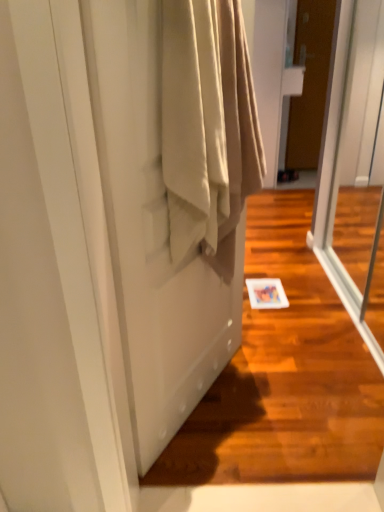
Measure the distance between satin beige curtain at lower left, the 1th screen door from the left, and camera.

The depth of satin beige curtain at lower left, the 1th screen door from the left, is 32.10 inches.

What do you see at coordinates (355, 172) in the screenshot? Image resolution: width=384 pixels, height=512 pixels. I see `transparent glass screen door at right, arranged as the 2th screen door when viewed from the left` at bounding box center [355, 172].

Describe the element at coordinates (310, 82) in the screenshot. The height and width of the screenshot is (512, 384). I see `brown matte door at upper right` at that location.

At what (x,y) coordinates should I click in order to perform the action: click on beige fabric at center. Please return your answer as a coordinate pair (x, y). This screenshot has height=512, width=384. Looking at the image, I should click on (207, 122).

From the image's perspective, relative to satin beige curtain at lower left, arranged as the 2th screen door when viewed from the right, is beige fabric at center above or below?

beige fabric at center is situated higher than satin beige curtain at lower left, arranged as the 2th screen door when viewed from the right, in the image.

Considering the sizes of beige fabric at center and satin beige curtain at lower left, the 1th screen door from the left, in the image, is beige fabric at center taller or shorter than satin beige curtain at lower left, the 1th screen door from the left,?

Considering their sizes, beige fabric at center has less height than satin beige curtain at lower left, the 1th screen door from the left.

Which object is closer to the camera taking this photo, beige fabric at center or satin beige curtain at lower left, arranged as the 2th screen door when viewed from the right?

satin beige curtain at lower left, arranged as the 2th screen door when viewed from the right, is in front.

Could you tell me if beige fabric at center is facing satin beige curtain at lower left, the 1th screen door from the left?

Yes, beige fabric at center faces towards satin beige curtain at lower left, the 1th screen door from the left.

Is brown matte door at upper right touching satin beige curtain at lower left, the 1th screen door from the left?

No, brown matte door at upper right is not beside satin beige curtain at lower left, the 1th screen door from the left.

Does brown matte door at upper right have a greater height compared to satin beige curtain at lower left, arranged as the 2th screen door when viewed from the right?

Correct, brown matte door at upper right is much taller as satin beige curtain at lower left, arranged as the 2th screen door when viewed from the right.

Based on the photo, is brown matte door at upper right oriented towards satin beige curtain at lower left, arranged as the 2th screen door when viewed from the right?

No, brown matte door at upper right is not facing towards satin beige curtain at lower left, arranged as the 2th screen door when viewed from the right.

How many degrees apart are the facing directions of brown matte door at upper right and satin beige curtain at lower left, the 1th screen door from the left?

The angle between the facing direction of brown matte door at upper right and the facing direction of satin beige curtain at lower left, the 1th screen door from the left, is 56.5 degrees.

From the image's perspective, which one is positioned lower, satin beige curtain at lower left, arranged as the 2th screen door when viewed from the right, or beige fabric at center?

satin beige curtain at lower left, arranged as the 2th screen door when viewed from the right.

Considering the positions of points (106, 53) and (234, 191), is point (106, 53) farther from camera compared to point (234, 191)?

No, (106, 53) is in front of (234, 191).

Is satin beige curtain at lower left, the 1th screen door from the left, aimed at beige fabric at center?

Yes, satin beige curtain at lower left, the 1th screen door from the left, faces towards beige fabric at center.

In the scene shown: Does satin beige curtain at lower left, arranged as the 2th screen door when viewed from the right, lie in front of beige fabric at center?

Yes, satin beige curtain at lower left, arranged as the 2th screen door when viewed from the right, is in front of beige fabric at center.

From a real-world perspective, is transparent glass screen door at right, which is counted as the first screen door, starting from the right, physically located above or below satin beige curtain at lower left, the 1th screen door from the left?

In terms of real-world spatial position, transparent glass screen door at right, which is counted as the first screen door, starting from the right, is above satin beige curtain at lower left, the 1th screen door from the left.

Does point (367, 195) lie behind point (162, 293)?

Yes, it is.

Based on the photo, does transparent glass screen door at right, which is counted as the first screen door, starting from the right, have a smaller size compared to satin beige curtain at lower left, arranged as the 2th screen door when viewed from the right?

No, transparent glass screen door at right, which is counted as the first screen door, starting from the right, is not smaller than satin beige curtain at lower left, arranged as the 2th screen door when viewed from the right.

Can you tell me how much transparent glass screen door at right, which is counted as the first screen door, starting from the right, and satin beige curtain at lower left, the 1th screen door from the left, differ in facing direction?

The facing directions of transparent glass screen door at right, which is counted as the first screen door, starting from the right, and satin beige curtain at lower left, the 1th screen door from the left, are 147 degrees apart.

From the image's perspective, is transparent glass screen door at right, arranged as the 2th screen door when viewed from the left, positioned above or below beige fabric at center?

transparent glass screen door at right, arranged as the 2th screen door when viewed from the left, is situated higher than beige fabric at center in the image.

Find the location of a particular element. The width and height of the screenshot is (384, 512). clothing located below the transparent glass screen door at right, which is counted as the first screen door, starting from the right (from the image's perspective) is located at coordinates (207, 122).

Based on their positions, is transparent glass screen door at right, arranged as the 2th screen door when viewed from the left, located to the left or right of beige fabric at center?

From the image, it's evident that transparent glass screen door at right, arranged as the 2th screen door when viewed from the left, is to the right of beige fabric at center.

Is beige fabric at center located within transparent glass screen door at right, which is counted as the first screen door, starting from the right?

Actually, beige fabric at center is outside transparent glass screen door at right, which is counted as the first screen door, starting from the right.

Is beige fabric at center completely or partially outside of brown matte door at upper right?

Indeed, beige fabric at center is completely outside brown matte door at upper right.

Are beige fabric at center and brown matte door at upper right located far from each other?

Yes, beige fabric at center and brown matte door at upper right are located far from each other.

From the image's perspective, is beige fabric at center located above or below brown matte door at upper right?

beige fabric at center is below brown matte door at upper right.

In the scene shown: From a real-world perspective, is beige fabric at center physically located above or below brown matte door at upper right?

Clearly, from a real-world perspective, beige fabric at center is above brown matte door at upper right.

Considering the points (210, 323) and (334, 173), which point is behind, point (210, 323) or point (334, 173)?

Positioned behind is point (334, 173).

Would you say satin beige curtain at lower left, the 1th screen door from the left, is inside or outside transparent glass screen door at right, which is counted as the first screen door, starting from the right?

satin beige curtain at lower left, the 1th screen door from the left, cannot be found inside transparent glass screen door at right, which is counted as the first screen door, starting from the right.

In the scene shown: In terms of width, does satin beige curtain at lower left, the 1th screen door from the left, look wider or thinner when compared to transparent glass screen door at right, arranged as the 2th screen door when viewed from the left?

Considering their sizes, satin beige curtain at lower left, the 1th screen door from the left, looks slimmer than transparent glass screen door at right, arranged as the 2th screen door when viewed from the left.

What are the coordinates of `screen door located in front of the transparent glass screen door at right, which is counted as the first screen door, starting from the right` in the screenshot? It's located at (154, 233).

At what (x,y) coordinates should I click in order to perform the action: click on screen door below the beige fabric at center (from the image's perspective). Please return your answer as a coordinate pair (x, y). The image size is (384, 512). Looking at the image, I should click on (154, 233).

From a real-world perspective, count 2nd screen doors downward from the brown matte door at upper right and point to it. Please provide its 2D coordinates.

[(154, 233)]

Looking at the image, which one is located closer to transparent glass screen door at right, which is counted as the first screen door, starting from the right, beige fabric at center or brown matte door at upper right?

Based on the image, brown matte door at upper right appears to be nearer to transparent glass screen door at right, which is counted as the first screen door, starting from the right.

From the picture: When comparing their distances from transparent glass screen door at right, which is counted as the first screen door, starting from the right, does satin beige curtain at lower left, the 1th screen door from the left, or brown matte door at upper right seem closer?

The object closer to transparent glass screen door at right, which is counted as the first screen door, starting from the right, is brown matte door at upper right.

Based on their spatial positions, is transparent glass screen door at right, which is counted as the first screen door, starting from the right, or beige fabric at center closer to brown matte door at upper right?

The object closer to brown matte door at upper right is transparent glass screen door at right, which is counted as the first screen door, starting from the right.

Considering their positions, is beige fabric at center positioned further to transparent glass screen door at right, arranged as the 2th screen door when viewed from the left, than satin beige curtain at lower left, arranged as the 2th screen door when viewed from the right?

Based on the image, beige fabric at center appears to be further to transparent glass screen door at right, arranged as the 2th screen door when viewed from the left.

When comparing their distances from brown matte door at upper right, does beige fabric at center or transparent glass screen door at right, arranged as the 2th screen door when viewed from the left, seem further?

beige fabric at center.

Which object lies further to the anchor point satin beige curtain at lower left, arranged as the 2th screen door when viewed from the right, beige fabric at center or brown matte door at upper right?

The object further to satin beige curtain at lower left, arranged as the 2th screen door when viewed from the right, is brown matte door at upper right.

Based on the photo, based on their spatial positions, is satin beige curtain at lower left, arranged as the 2th screen door when viewed from the right, or transparent glass screen door at right, which is counted as the first screen door, starting from the right, closer to beige fabric at center?

satin beige curtain at lower left, arranged as the 2th screen door when viewed from the right, is closer to beige fabric at center.

Looking at the image, which one is located further to satin beige curtain at lower left, arranged as the 2th screen door when viewed from the right, transparent glass screen door at right, arranged as the 2th screen door when viewed from the left, or beige fabric at center?

The object further to satin beige curtain at lower left, arranged as the 2th screen door when viewed from the right, is transparent glass screen door at right, arranged as the 2th screen door when viewed from the left.

Image resolution: width=384 pixels, height=512 pixels. Find the location of `screen door between satin beige curtain at lower left, the 1th screen door from the left, and brown matte door at upper right from front to back`. screen door between satin beige curtain at lower left, the 1th screen door from the left, and brown matte door at upper right from front to back is located at coordinates (355, 172).

Where is `screen door positioned between beige fabric at center and brown matte door at upper right from near to far`? The image size is (384, 512). screen door positioned between beige fabric at center and brown matte door at upper right from near to far is located at coordinates (355, 172).

Find the location of a particular element. Image resolution: width=384 pixels, height=512 pixels. clothing between satin beige curtain at lower left, the 1th screen door from the left, and transparent glass screen door at right, arranged as the 2th screen door when viewed from the left, from left to right is located at coordinates (207, 122).

Identify the location of clothing positioned between satin beige curtain at lower left, the 1th screen door from the left, and brown matte door at upper right from near to far. The image size is (384, 512). (207, 122).